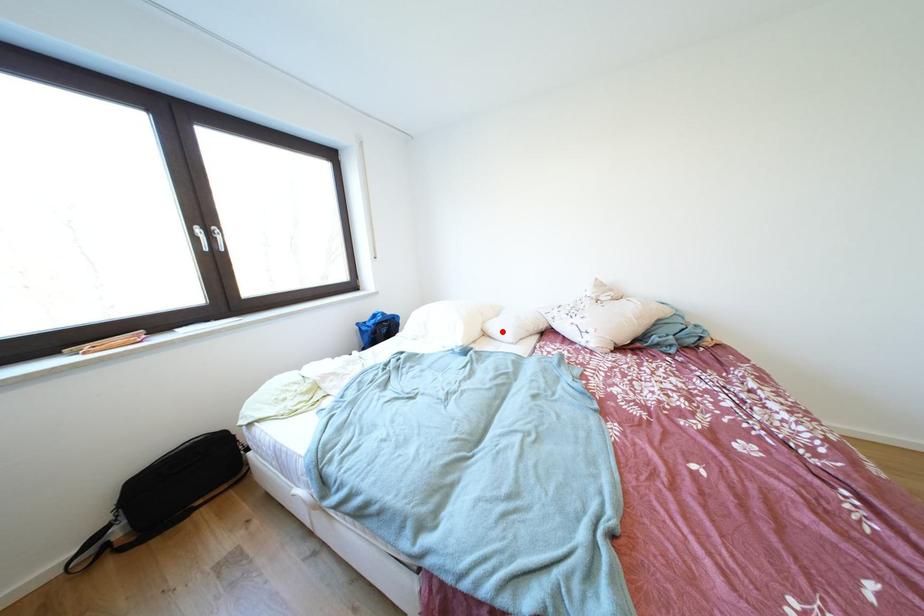
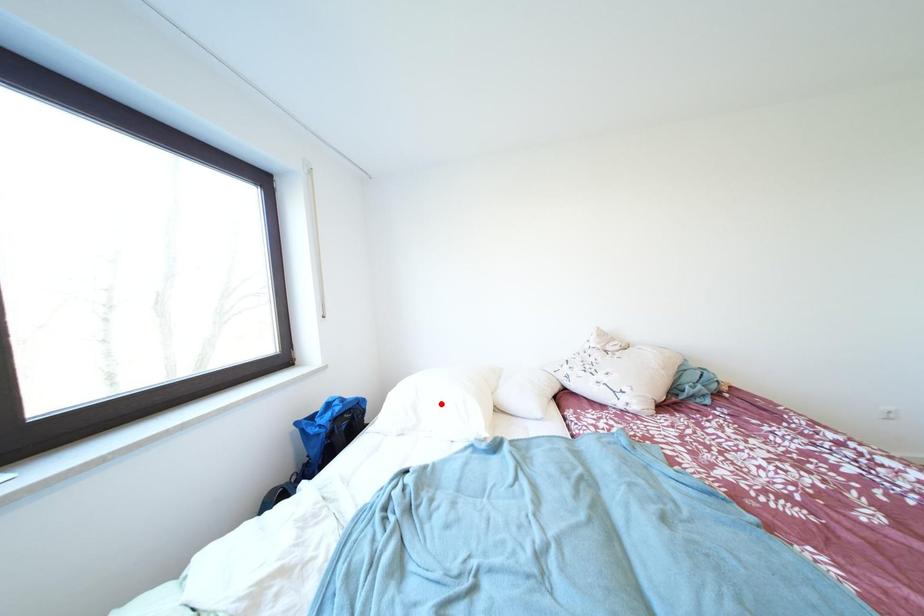
I am providing you with two images of the same scene from different viewpoints. A red point is marked on the first image and another point is marked on the second image. Is the red point in image1 aligned with the point shown in image2?

No